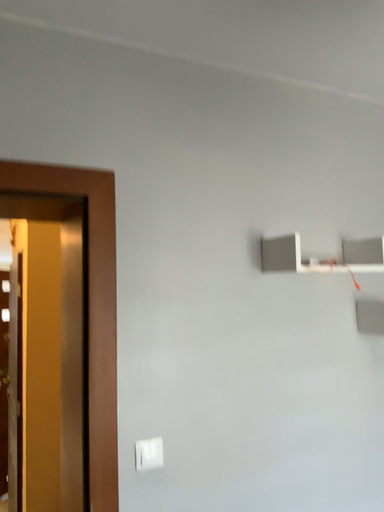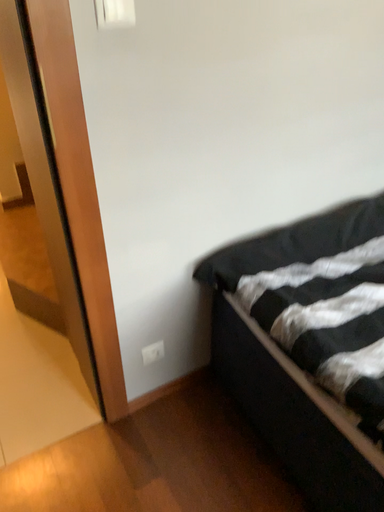
Question: Which way did the camera rotate in the video?

Choices:
 (A) rotated upward
 (B) rotated downward

Answer: (B)